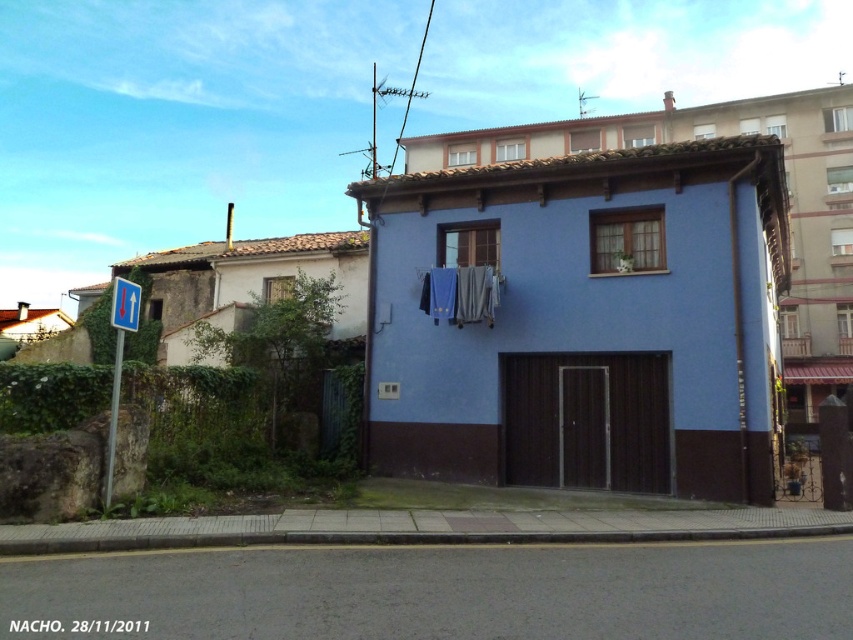
You are a delivery person trying to reach the front door of the blue building. You notice the blue fabric laundry at center and the blue plastic sign at left. Which object is closer to the blue building?

The blue fabric laundry at center is closer to the blue building than the blue plastic sign at left because it is only 16.58 feet away from the sign, implying the laundry is between the building and the sign.

You are a delivery person trying to avoid hitting the blue fabric laundry at center and the blue plastic sign at left with your package. Which object is shorter and therefore safer to pass under?

The blue fabric laundry at center is shorter than the blue plastic sign at left, so it is safer to pass under the blue fabric laundry at center.

You are standing on the residential street and want to take a photo of both the blue fabric laundry at center and the blue plastic sign at left. Which object should you focus on first to ensure both are in the frame?

You should focus on the blue plastic sign at left first because it is farther away than the blue fabric laundry at center, ensuring both are in the frame.